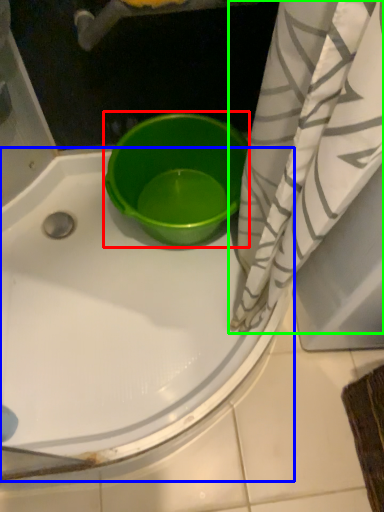
Question: Which object is the farthest from basin (highlighted by a red box)? Choose among these: bathtub (highlighted by a blue box) or curtain (highlighted by a green box).

Choices:
 (A) bathtub
 (B) curtain

Answer: (B)